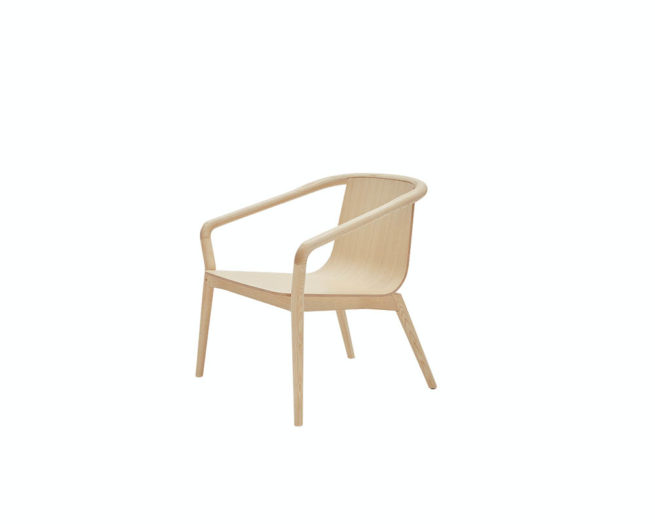
Locate an element on the screen. The height and width of the screenshot is (524, 655). right arm rest is located at coordinates (234, 217).